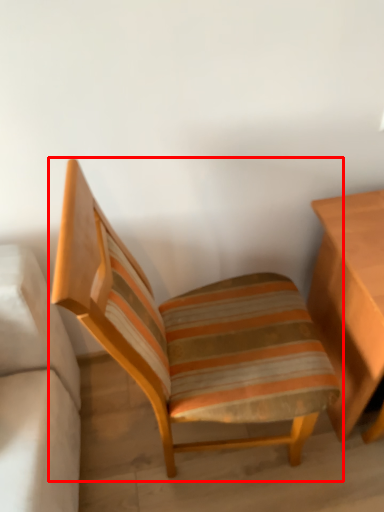
Question: From the image's perspective, considering the relative positions of chair (annotated by the red box) and table in the image provided, where is chair (annotated by the red box) located with respect to the staircase?

Choices:
 (A) below
 (B) above

Answer: (A)